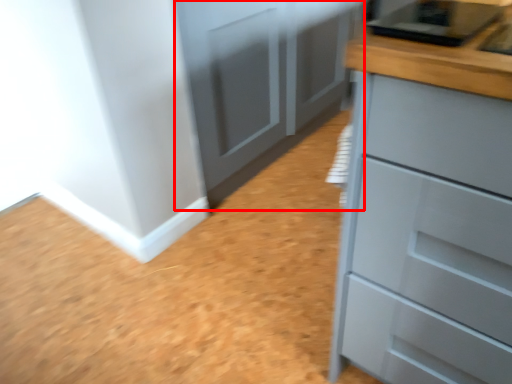
Question: From the image's perspective, where is cupboard (annotated by the red box) located in relation to chest of drawers in the image?

Choices:
 (A) above
 (B) below

Answer: (A)